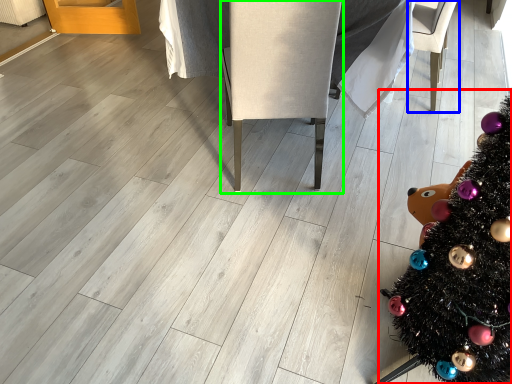
Question: Estimate the real-world distances between objects in this image. Which object is farther from christmas tree (highlighted by a red box), armchair (highlighted by a blue box) or armchair (highlighted by a green box)?

Choices:
 (A) armchair
 (B) armchair

Answer: (A)